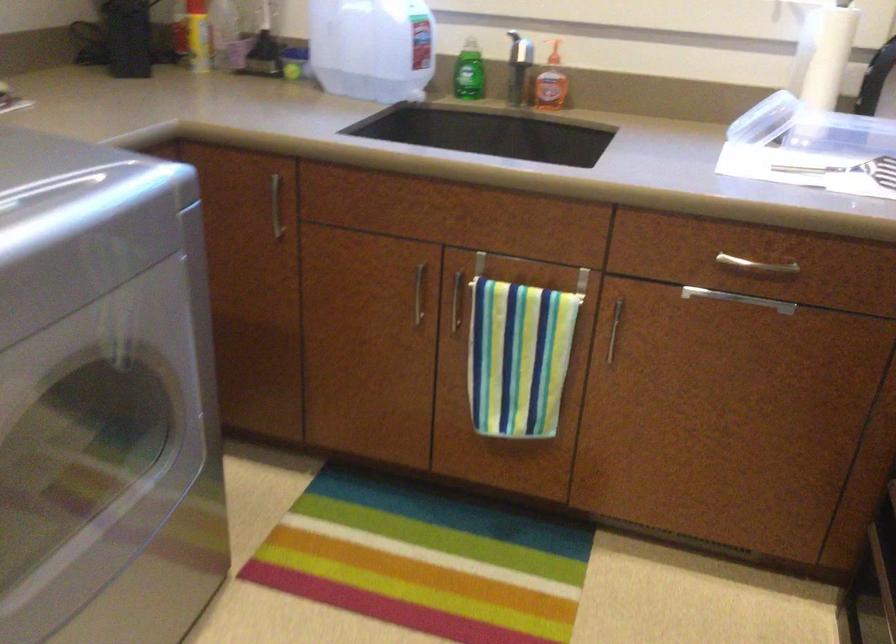
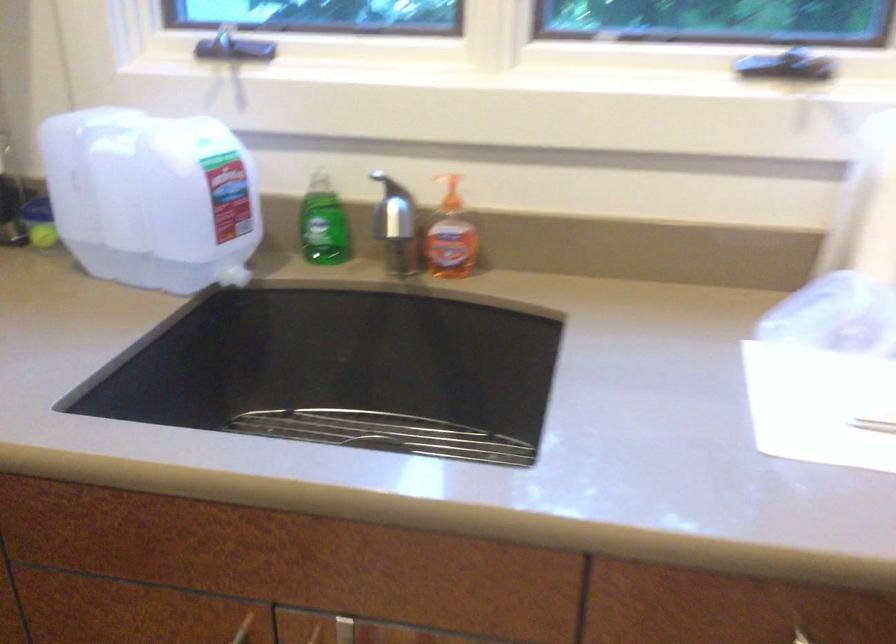
Find the pixel in the second image that matches (479,265) in the first image.

(343, 630)